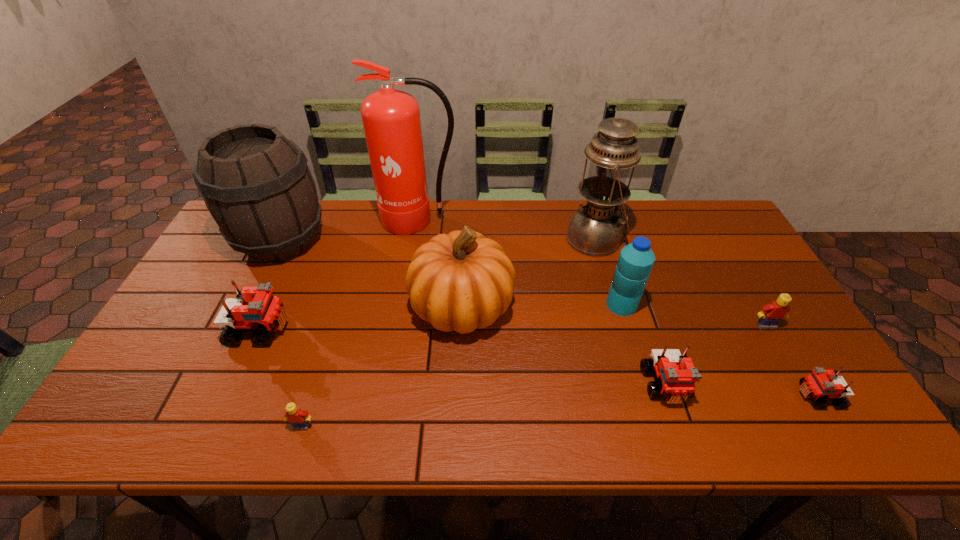
Image resolution: width=960 pixels, height=540 pixels. Identify the location of red Lego that is the second closest to the rightmost red Lego. (255, 309).